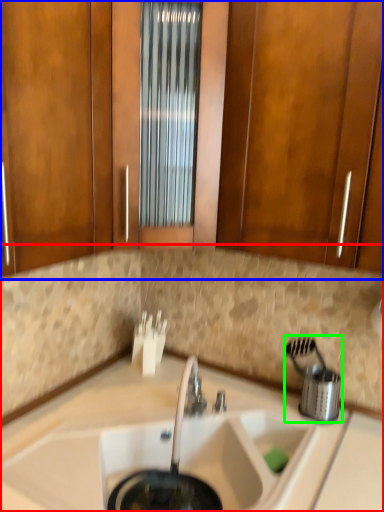
Question: Which is farther away from countertop (highlighted by a red box)? cabinetry (highlighted by a blue box) or appliance (highlighted by a green box)?

Choices:
 (A) cabinetry
 (B) appliance

Answer: (A)